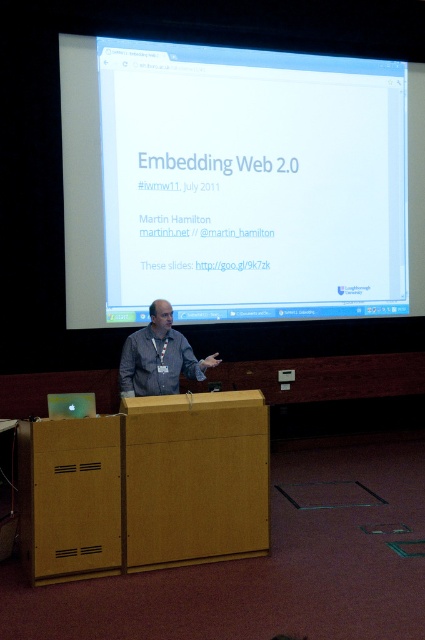
You are an event photographer at the front row. You want to capture a photo of the gray fabric shirt at center and the white glossy projector screen at upper center. Which object is wider?

The white glossy projector screen at upper center is wider than the gray fabric shirt at center.